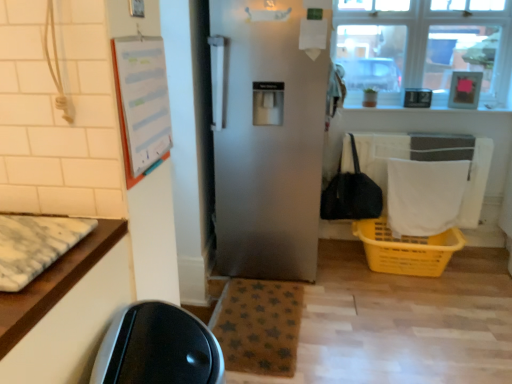
At what (x,y) coordinates should I click in order to perform the action: click on unoccupied region to the right of yellow plastic basket at lower right. Please return your answer as a coordinate pair (x, y). This screenshot has height=384, width=512. Looking at the image, I should click on pos(484,276).